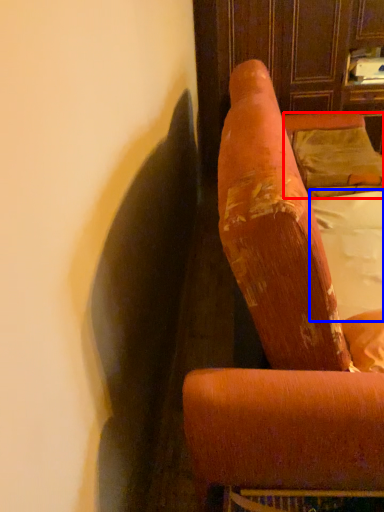
Question: Among these objects, which one is nearest to the camera, pillow (highlighted by a red box) or sheet (highlighted by a blue box)?

Choices:
 (A) pillow
 (B) sheet

Answer: (B)